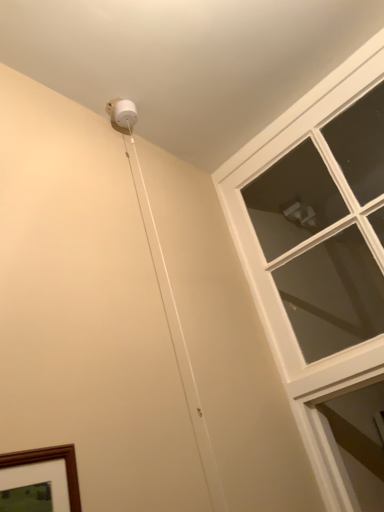
Describe the element at coordinates (271, 264) in the screenshot. I see `clear glass window at upper right` at that location.

Where is `clear glass window at upper right`? This screenshot has width=384, height=512. clear glass window at upper right is located at coordinates (271, 264).

This screenshot has width=384, height=512. Find the location of `clear glass window at upper right`. clear glass window at upper right is located at coordinates [271, 264].